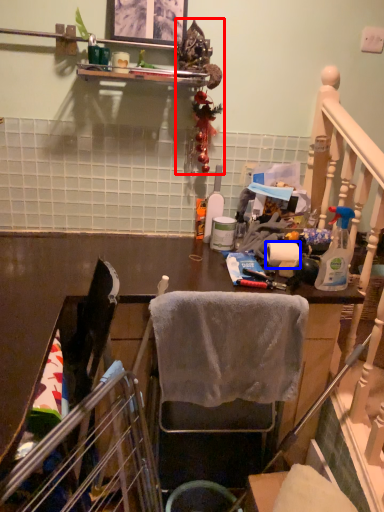
Question: Which object is closer to the camera taking this photo, christmas decoration (highlighted by a red box) or toilet paper (highlighted by a blue box)?

Choices:
 (A) christmas decoration
 (B) toilet paper

Answer: (A)